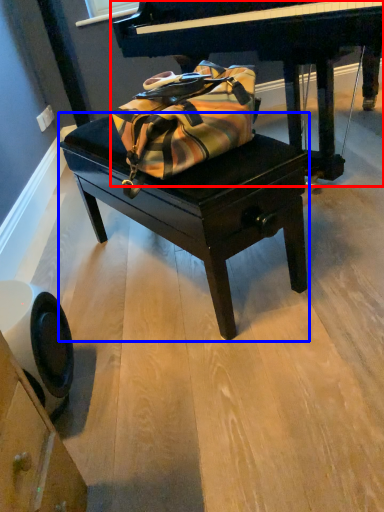
Question: Which point is further to the camera, piano (highlighted by a red box) or table (highlighted by a blue box)?

Choices:
 (A) piano
 (B) table

Answer: (A)